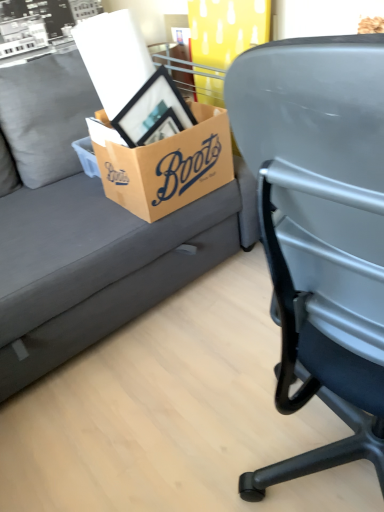
Question: Considering the positions of brown cardboard box at center and matte gray couch at upper left in the image, is brown cardboard box at center taller or shorter than matte gray couch at upper left?

Choices:
 (A) short
 (B) tall

Answer: (A)

Question: Considering the positions of point (185, 154) and point (39, 199), is point (185, 154) closer or farther from the camera than point (39, 199)?

Choices:
 (A) farther
 (B) closer

Answer: (B)

Question: In terms of width, does brown cardboard box at center look wider or thinner when compared to matte gray couch at upper left?

Choices:
 (A) wide
 (B) thin

Answer: (B)

Question: Visually, is matte gray couch at upper left positioned to the left or to the right of brown cardboard box at center?

Choices:
 (A) left
 (B) right

Answer: (A)

Question: Looking at their shapes, would you say matte gray couch at upper left is wider or thinner than brown cardboard box at center?

Choices:
 (A) wide
 (B) thin

Answer: (A)

Question: Is point (178, 260) closer or farther from the camera than point (226, 140)?

Choices:
 (A) closer
 (B) farther

Answer: (B)

Question: From a real-world perspective, is matte gray couch at upper left above or below brown cardboard box at center?

Choices:
 (A) below
 (B) above

Answer: (A)